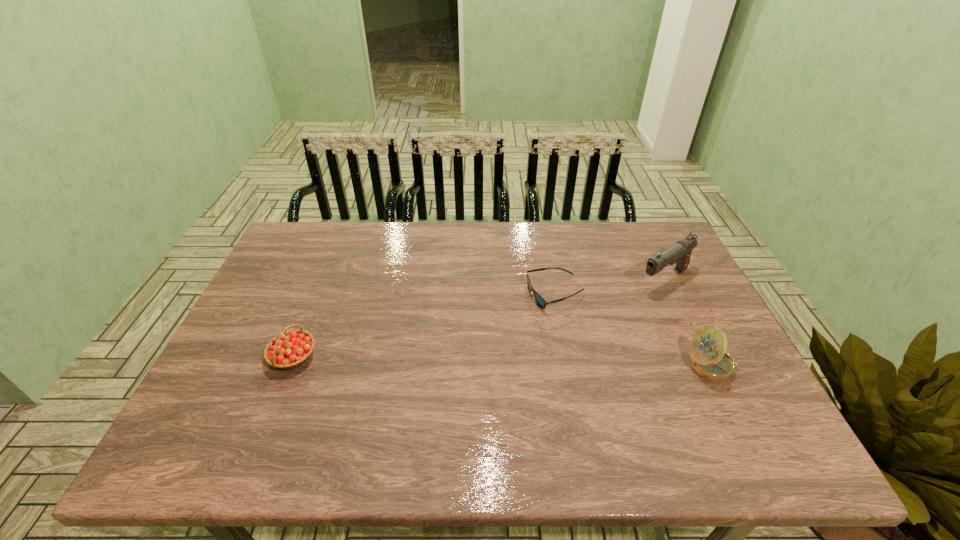
Where is `blank area at the left edge`? blank area at the left edge is located at coordinates (288, 330).

Locate an element on the screen. Image resolution: width=960 pixels, height=540 pixels. vacant region at the far left corner of the desktop is located at coordinates (312, 251).

This screenshot has height=540, width=960. Identify the location of vacant space at the far right corner of the desktop. (640, 236).

Image resolution: width=960 pixels, height=540 pixels. I want to click on vacant point located between the gun and the strawberry, so click(479, 319).

Find the location of a particular element. This screenshot has height=540, width=960. vacant area between the sunglasses and the third shortest object is located at coordinates (634, 330).

Find the location of `vacant area that lies between the third shortest object and the gun`. vacant area that lies between the third shortest object and the gun is located at coordinates (688, 323).

Locate an element on the screen. The height and width of the screenshot is (540, 960). blank region between the third shortest object and the gun is located at coordinates (688, 323).

This screenshot has height=540, width=960. I want to click on vacant area between the third shortest object and the sunglasses, so click(x=634, y=330).

Find the location of a particular element. free space that is in between the second tallest object and the shortest object is located at coordinates (634, 330).

I want to click on vacant point located between the third object from right to left and the strawberry, so click(x=424, y=326).